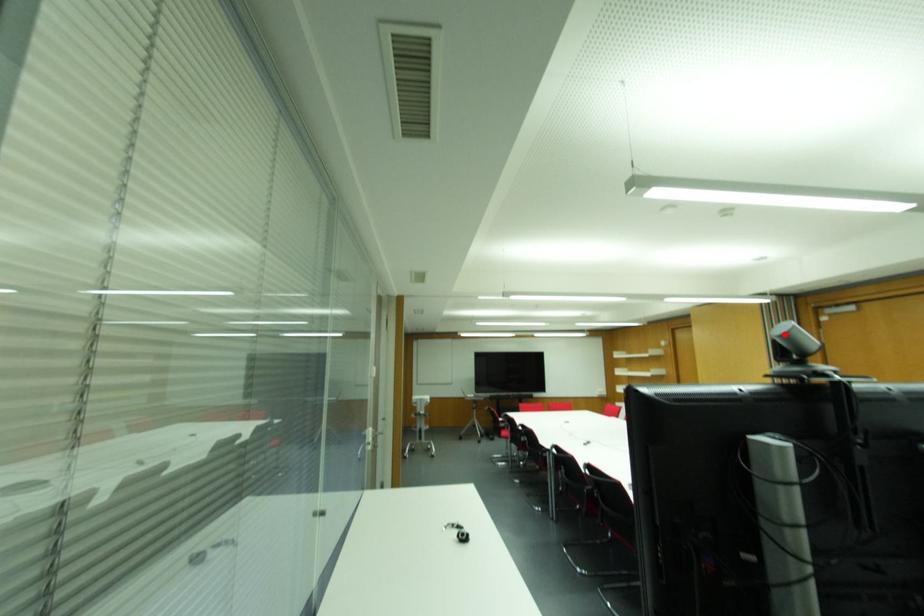
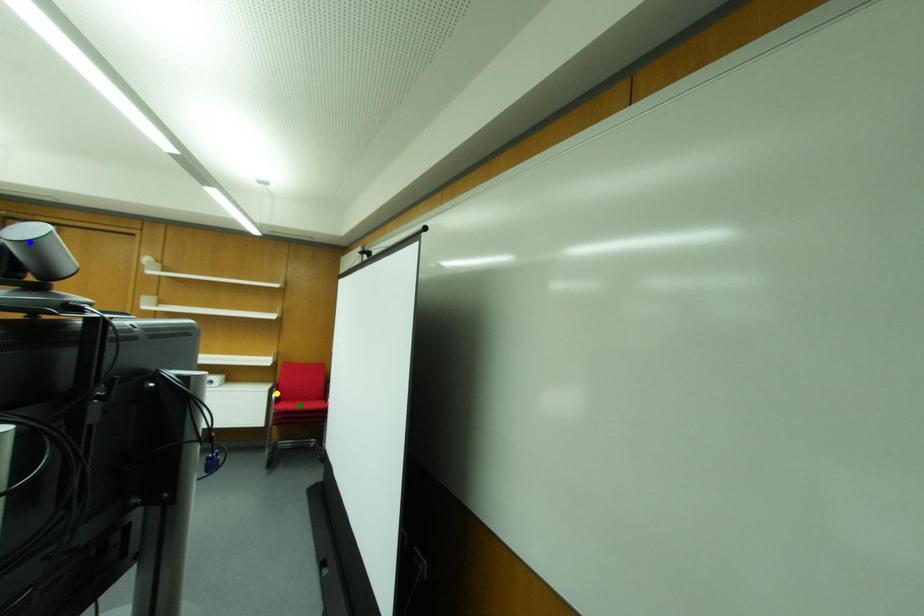
Question: I am providing you with two images of the same scene from different viewpoints. A red point is marked on the first image. You are given multiple points on the second image. In image 2, which mark is for the same physical point as the one in image 1?

Choices:
 (A) yellow point
 (B) blue point
 (C) green point

Answer: (B)